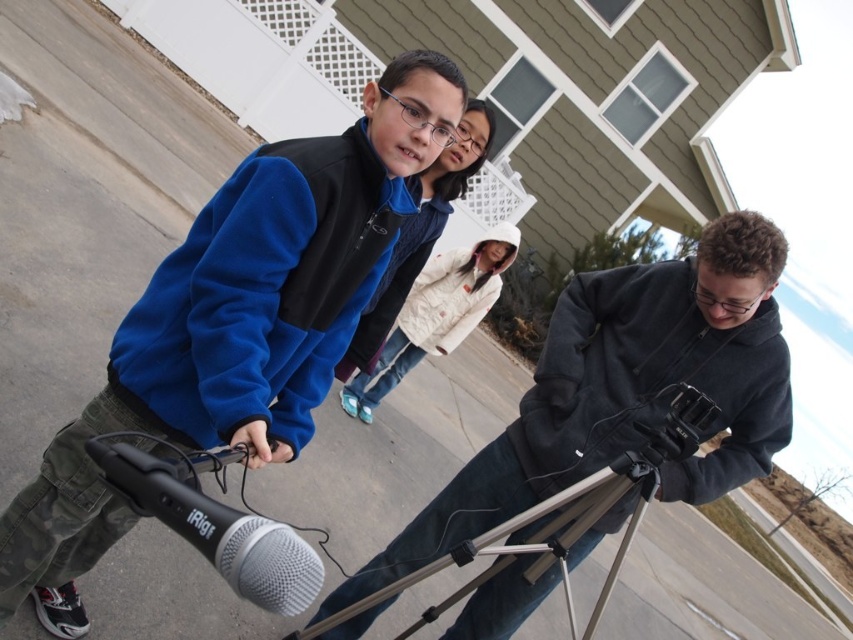
Question: Does white cotton sweatshirt at center have a greater width compared to black plastic video camera at lower right?

Choices:
 (A) no
 (B) yes

Answer: (B)

Question: Which of the following is the farthest from the observer?

Choices:
 (A) (428, 275)
 (B) (299, 186)
 (C) (245, 413)
 (D) (706, 422)

Answer: (A)

Question: Does white cotton sweatshirt at center appear on the right side of black plastic video camera at lower right?

Choices:
 (A) yes
 (B) no

Answer: (B)

Question: Which point is closer to the camera?

Choices:
 (A) black fleece sweatshirt at lower right
 (B) blue fleece sweatshirt at left
 (C) white cotton sweatshirt at center
 (D) silver/metallic microphone at lower left

Answer: (D)

Question: Which point is farther to the camera?

Choices:
 (A) white cotton jacket at center
 (B) dark gray hoodie at center
 (C) black plastic video camera at lower right

Answer: (A)

Question: Is silver metallic tripod at center positioned behind silver/metallic microphone at lower left?

Choices:
 (A) yes
 (B) no

Answer: (A)